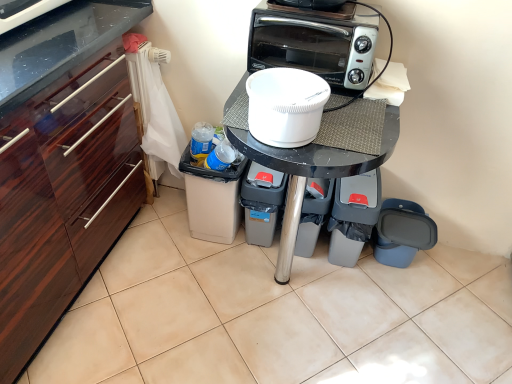
Find the location of `vacant space situated above silver metallic toaster oven at upper center (from a real-world perspective)`. vacant space situated above silver metallic toaster oven at upper center (from a real-world perspective) is located at coordinates (329, 12).